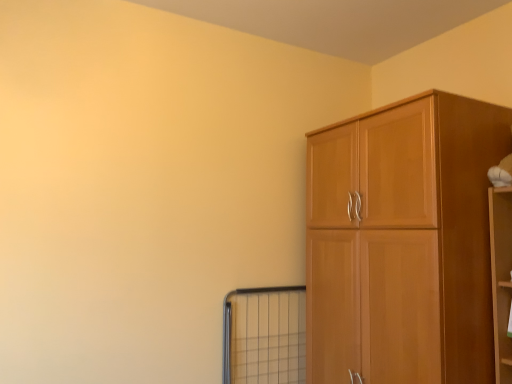
Question: Is metal grid window at lower center turned away from light brown wood cupboard at right?

Choices:
 (A) yes
 (B) no

Answer: (B)

Question: Could you tell me if metal grid window at lower center is turned towards light brown wood cupboard at right?

Choices:
 (A) no
 (B) yes

Answer: (A)

Question: From a real-world perspective, is metal grid window at lower center below light brown wood cupboard at right?

Choices:
 (A) yes
 (B) no

Answer: (A)

Question: Would you consider metal grid window at lower center to be distant from light brown wood cupboard at right?

Choices:
 (A) yes
 (B) no

Answer: (B)

Question: Is metal grid window at lower center next to light brown wood cupboard at right and touching it?

Choices:
 (A) yes
 (B) no

Answer: (B)

Question: From the image's perspective, is metal grid window at lower center on light brown wood cupboard at right?

Choices:
 (A) yes
 (B) no

Answer: (B)

Question: Is metal grid window at lower center at the back of light brown wood cupboard at right?

Choices:
 (A) no
 (B) yes

Answer: (A)

Question: Is light brown wood cupboard at right behind metal grid window at lower center?

Choices:
 (A) yes
 (B) no

Answer: (B)

Question: From a real-world perspective, is light brown wood cupboard at right on metal grid window at lower center?

Choices:
 (A) no
 (B) yes

Answer: (B)

Question: Can you confirm if light brown wood cupboard at right is thinner than metal grid window at lower center?

Choices:
 (A) no
 (B) yes

Answer: (A)

Question: Considering the relative sizes of light brown wood cupboard at right and metal grid window at lower center in the image provided, is light brown wood cupboard at right bigger than metal grid window at lower center?

Choices:
 (A) no
 (B) yes

Answer: (B)

Question: Is light brown wood cupboard at right to the left of metal grid window at lower center from the viewer's perspective?

Choices:
 (A) no
 (B) yes

Answer: (A)

Question: In the image, is metal grid window at lower center positioned in front of or behind light brown wood cupboard at right?

Choices:
 (A) behind
 (B) front

Answer: (A)